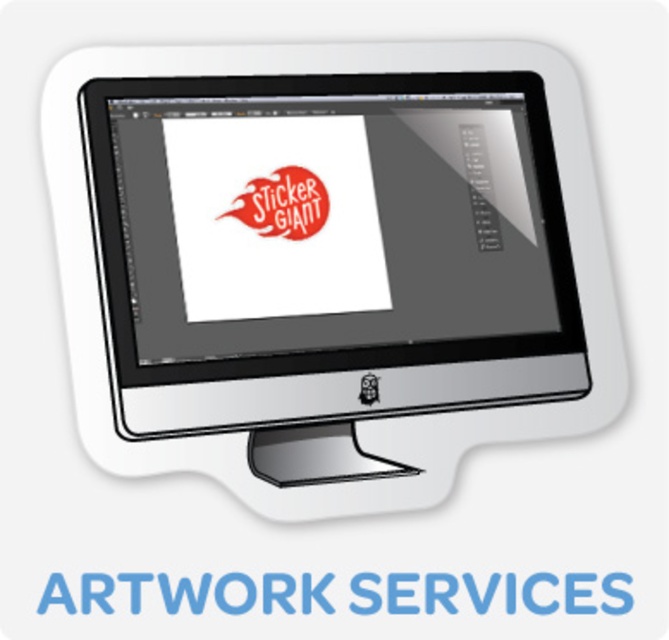
You are organizing your desk and want to place a new white matte sticker at center. There is already a white glossy desktop computer at center. Can you place the sticker to the left of the computer?

The white glossy desktop computer at center is positioned on the right side of the white matte sticker at center, which means the sticker is already placed to the left of the computer.

You are standing in front of the computer monitor and want to place a new object exactly at the center of the white glossy desktop computer at center. According to the coordinates provided, where should you place it?

The center of the white glossy desktop computer at center is located at the coordinates point (328,260).